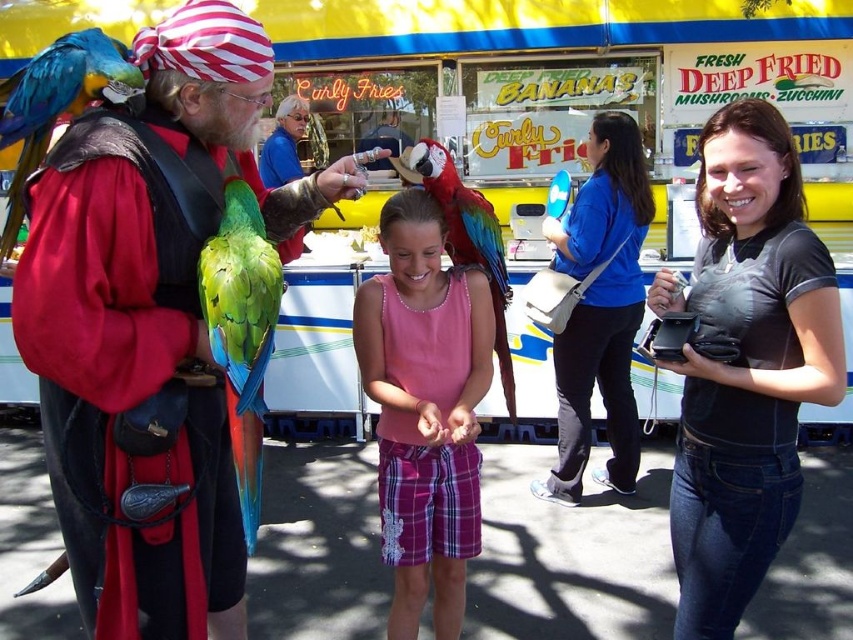
Looking at this image, you are a photographer standing 3 feet away from the matte black vest at center. You want to take a photo of the camera. Can you reach it without moving? The camera is positioned to the right of the girl.

The distance between the matte black vest at center and the camera is 5.67 feet. Since you are only 3 feet away from the matte black vest at center, you are still 2.67 feet away from the camera. Therefore, you cannot reach the camera without moving closer.

You are a photographer trying to capture the black matte purse at center and the blue fabric purse at center in your shot. Which purse will appear larger in your photo?

The black matte purse at center will appear larger in the photo because it is closer to the viewer than the blue fabric purse at center.

You are standing at the point labeled point (169, 497) and want to take a photo of the point labeled point (422, 291). Is there any obstruction between you and the point you want to photograph?

Point (169, 497) is in front of point (422, 291), so there is an obstruction between you and the point you want to photograph.